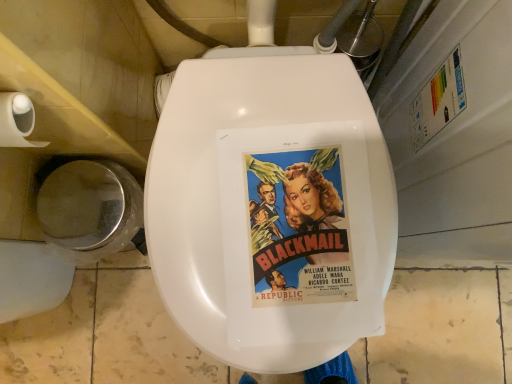
Question: Does shiny metallic toilet bowl at lower left have a greater width compared to white matte toilet paper at left?

Choices:
 (A) no
 (B) yes

Answer: (B)

Question: Does shiny metallic toilet bowl at lower left touch white matte toilet paper at left?

Choices:
 (A) yes
 (B) no

Answer: (B)

Question: Is shiny metallic toilet bowl at lower left facing away from white matte toilet paper at left?

Choices:
 (A) no
 (B) yes

Answer: (A)

Question: Can you confirm if shiny metallic toilet bowl at lower left is positioned to the left of white matte toilet paper at left?

Choices:
 (A) yes
 (B) no

Answer: (A)

Question: Considering the relative sizes of shiny metallic toilet bowl at lower left and white matte toilet paper at left in the image provided, is shiny metallic toilet bowl at lower left thinner than white matte toilet paper at left?

Choices:
 (A) no
 (B) yes

Answer: (A)

Question: Does shiny metallic toilet bowl at lower left appear on the right side of white matte toilet paper at left?

Choices:
 (A) no
 (B) yes

Answer: (A)

Question: Is vivid paper movie poster at center shorter than shiny metallic toilet bowl at lower left?

Choices:
 (A) no
 (B) yes

Answer: (B)

Question: Considering the relative sizes of vivid paper movie poster at center and shiny metallic toilet bowl at lower left in the image provided, is vivid paper movie poster at center thinner than shiny metallic toilet bowl at lower left?

Choices:
 (A) no
 (B) yes

Answer: (A)

Question: Considering the relative sizes of vivid paper movie poster at center and shiny metallic toilet bowl at lower left in the image provided, is vivid paper movie poster at center wider than shiny metallic toilet bowl at lower left?

Choices:
 (A) no
 (B) yes

Answer: (B)

Question: Is vivid paper movie poster at center positioned with its back to shiny metallic toilet bowl at lower left?

Choices:
 (A) no
 (B) yes

Answer: (A)

Question: Can you confirm if vivid paper movie poster at center is bigger than shiny metallic toilet bowl at lower left?

Choices:
 (A) no
 (B) yes

Answer: (A)

Question: Is vivid paper movie poster at center to the left of shiny metallic toilet bowl at lower left from the viewer's perspective?

Choices:
 (A) no
 (B) yes

Answer: (A)

Question: Does white matte toilet paper at left have a lesser width compared to vivid paper movie poster at center?

Choices:
 (A) no
 (B) yes

Answer: (B)